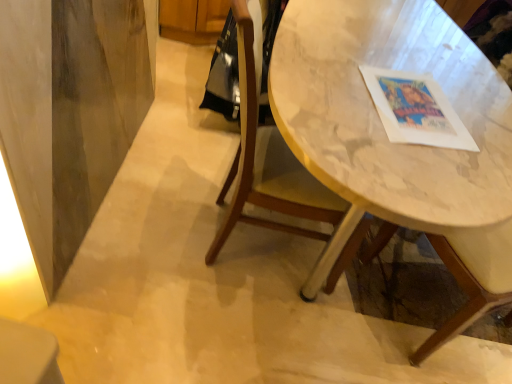
In order to face wooden chair at center, should I rotate leftwards or rightwards?

Turn right approximately 4.830 degrees to face it.

At what (x,y) coordinates should I click in order to perform the action: click on wooden chair at center. Please return your answer as a coordinate pair (x, y). Looking at the image, I should click on (265, 140).

Describe the element at coordinates (265, 140) in the screenshot. This screenshot has width=512, height=384. I see `wooden chair at center` at that location.

The width and height of the screenshot is (512, 384). What do you see at coordinates (400, 144) in the screenshot?
I see `marble table at center` at bounding box center [400, 144].

Locate an element on the screen. Image resolution: width=512 pixels, height=384 pixels. marble table at center is located at coordinates (400, 144).

Where is `wooden chair at center`? The height and width of the screenshot is (384, 512). wooden chair at center is located at coordinates (265, 140).

Is marble table at center to the left or to the right of wooden chair at center in the image?

Clearly, marble table at center is on the right of wooden chair at center in the image.

Which object is closer to the camera, marble table at center or wooden chair at center?

marble table at center is in front.

Is point (474, 165) behind point (223, 232)?

No, it is in front of (223, 232).

From the image's perspective, between marble table at center and wooden chair at center, which one is located above?

marble table at center is shown above in the image.

From a real-world perspective, between marble table at center and wooden chair at center, who is vertically higher?

wooden chair at center, from a real-world perspective.

Can you confirm if marble table at center is wider than wooden chair at center?

Indeed, marble table at center has a greater width compared to wooden chair at center.

Is marble table at center taller than wooden chair at center?

Incorrect, the height of marble table at center is not larger of that of wooden chair at center.

Which of these two, marble table at center or wooden chair at center, is bigger?

Bigger between the two is marble table at center.

Would you say marble table at center contains wooden chair at center?

Yes, wooden chair at center is surrounded by marble table at center.

Can you see marble table at center touching wooden chair at center?

No, marble table at center is not next to wooden chair at center.

Is marble table at center oriented towards wooden chair at center?

Yes.

What's the angular difference between marble table at center and wooden chair at center's facing directions?

The angle between the facing direction of marble table at center and the facing direction of wooden chair at center is 0.205 degrees.

How far apart are marble table at center and wooden chair at center?

marble table at center and wooden chair at center are 17.36 inches apart.

Identify the location of chair located below the marble table at center (from the image's perspective). The width and height of the screenshot is (512, 384). (265, 140).

Between wooden chair at center and marble table at center, which one appears on the right side from the viewer's perspective?

From the viewer's perspective, marble table at center appears more on the right side.

Based on the photo, which object is more forward, wooden chair at center or marble table at center?

Positioned in front is marble table at center.

Does point (272, 148) come farther from viewer compared to point (297, 108)?

Yes, point (272, 148) is farther from viewer.

From the image's perspective, is wooden chair at center positioned above or below marble table at center?

Clearly, from the image's perspective, wooden chair at center is below marble table at center.

From a real-world perspective, is wooden chair at center positioned over marble table at center based on gravity?

Yes.

Based on the photo, considering the sizes of objects wooden chair at center and marble table at center in the image provided, who is thinner, wooden chair at center or marble table at center?

With smaller width is wooden chair at center.

Looking at this image, from their relative heights in the image, would you say wooden chair at center is taller or shorter than marble table at center?

Considering their sizes, wooden chair at center has more height than marble table at center.

Considering the relative sizes of wooden chair at center and marble table at center in the image provided, is wooden chair at center smaller than marble table at center?

Yes.

Is wooden chair at center positioned beyond the bounds of marble table at center?

That's incorrect, wooden chair at center is not completely outside marble table at center.

Is wooden chair at center touching marble table at center?

No, wooden chair at center is not with marble table at center.

Is wooden chair at center oriented towards marble table at center?

Yes.

How many degrees apart are the facing directions of wooden chair at center and marble table at center?

They differ by 0.205 degrees in their facing directions.

This screenshot has height=384, width=512. What are the coordinates of `table lying above the wooden chair at center (from the image's perspective)` in the screenshot? It's located at (400, 144).

This screenshot has width=512, height=384. Identify the location of chair above the marble table at center (from a real-world perspective). (265, 140).

Identify the location of chair below the marble table at center (from the image's perspective). (265, 140).